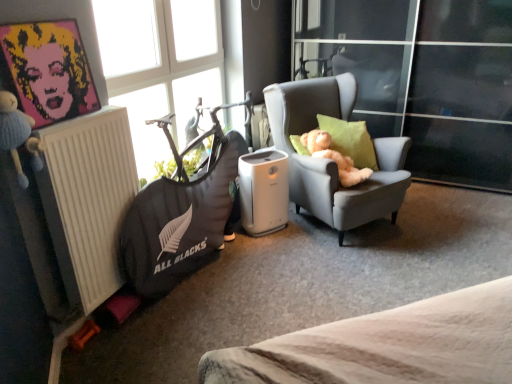
Question: Is point (193, 228) positioned closer to the camera than point (334, 119)?

Choices:
 (A) closer
 (B) farther

Answer: (A)

Question: From the image's perspective, relative to green fabric pillow at right, is dark gray fabric bean bag at left above or below?

Choices:
 (A) below
 (B) above

Answer: (A)

Question: Estimate the real-world distances between objects in this image. Which object is closer to the transparent glass window at upper left?

Choices:
 (A) gray fabric armchair at center
 (B) pop art portrait of marilyn monroe at upper left
 (C) green fabric pillow at right
 (D) dark gray fabric bean bag at left
 (E) white matte radiator at left

Answer: (D)

Question: Which object is the closest to the transparent glass window at upper left?

Choices:
 (A) green fabric pillow at right
 (B) dark gray fabric bean bag at left
 (C) white matte radiator at left
 (D) pop art portrait of marilyn monroe at upper left
 (E) gray fabric armchair at center

Answer: (B)